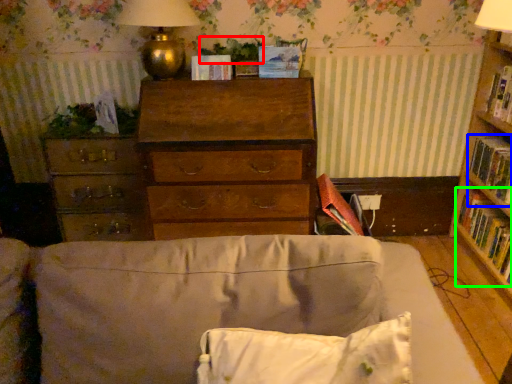
Question: Which object is positioned farthest from plant (highlighted by a red box)? Select from paperback book (highlighted by a blue box) and book (highlighted by a green box).

Choices:
 (A) paperback book
 (B) book

Answer: (B)